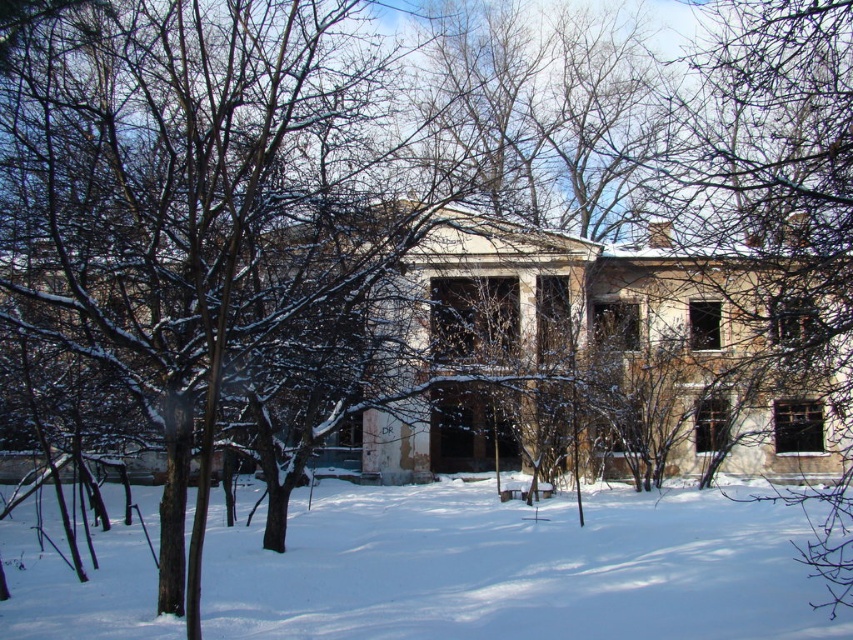
You are standing in the winter scene and want to take a photo of the brown bark tree at right. Where should you position yourself relative to the white powdery snow at center to ensure the tree is in the background?

You should position yourself in front of the white powdery snow at center so that the brown bark tree at right is behind the snow, making it the background element in your photo.

You are an explorer trying to cross the snow in the winter scene. You see the white powdery snow at center and the brown bark tree at right. Which one is closer to you?

The white powdery snow at center is closer to you because it is smaller than the brown bark tree at right, indicating it is nearer in the scene.

You are standing in front of the old ruined building and want to take a photo that includes both point A at point (598, 502) and point B at point (843, 228). Which point will appear closer to the camera in the photo?

Point A at point (598, 502) will appear closer to the camera in the photo because it is further to the camera than point B at point (843, 228) according to the description.